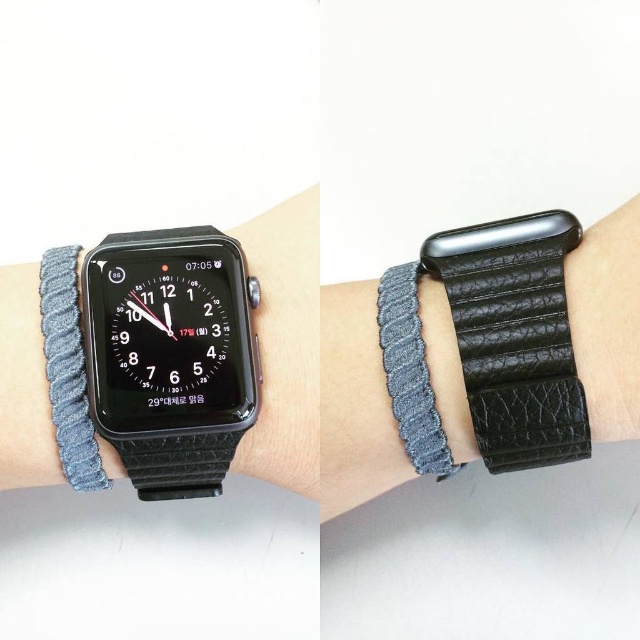
Consider the image. Does black leather wristband at center appear on the left side of gray woven bracelet at center?

Incorrect, black leather wristband at center is not on the left side of gray woven bracelet at center.

Is black leather wristband at center taller than gray woven bracelet at center?

Yes, black leather wristband at center is taller than gray woven bracelet at center.

I want to click on black leather wristband at center, so coord(515,337).

Where is `black leather wristband at center`? The width and height of the screenshot is (640, 640). black leather wristband at center is located at coordinates (515, 337).

Is black leather watch at left positioned behind denim woven band at left?

No, it is in front of denim woven band at left.

Does point (246, 336) come farther from viewer compared to point (48, 300)?

Yes, it is behind point (48, 300).

Locate an element on the screen. This screenshot has width=640, height=640. black leather watch at left is located at coordinates (170, 355).

The height and width of the screenshot is (640, 640). I want to click on black leather watch at left, so click(x=170, y=355).

Does black leather watch at left come behind black leather wristband at center?

No, it is not.

Does black leather watch at left have a greater height compared to black leather wristband at center?

Indeed, black leather watch at left has a greater height compared to black leather wristband at center.

Does point (221, 266) come closer to viewer compared to point (529, 234)?

Yes, point (221, 266) is in front of point (529, 234).

Image resolution: width=640 pixels, height=640 pixels. What are the coordinates of `black leather watch at left` in the screenshot? It's located at [170, 355].